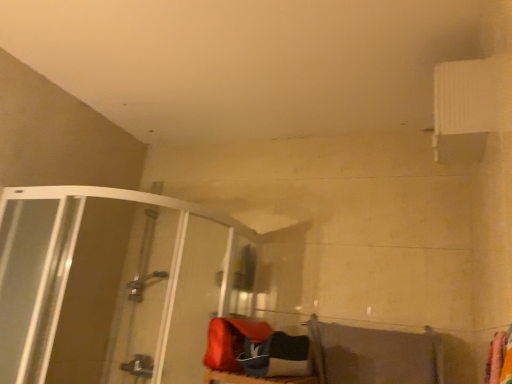
Question: Is transparent glass shower door at left in front of or behind gray fabric beach towel at lower right in the image?

Choices:
 (A) behind
 (B) front

Answer: (B)

Question: Is transparent glass shower door at left spatially inside gray fabric beach towel at lower right, or outside of it?

Choices:
 (A) inside
 (B) outside

Answer: (B)

Question: From a real-world perspective, is transparent glass shower door at left above or below gray fabric beach towel at lower right?

Choices:
 (A) below
 (B) above

Answer: (B)

Question: Considering the positions of gray fabric beach towel at lower right and transparent glass shower door at left in the image, is gray fabric beach towel at lower right wider or thinner than transparent glass shower door at left?

Choices:
 (A) thin
 (B) wide

Answer: (A)

Question: Do you think gray fabric beach towel at lower right is within transparent glass shower door at left, or outside of it?

Choices:
 (A) inside
 (B) outside

Answer: (B)

Question: From the image's perspective, is gray fabric beach towel at lower right positioned above or below transparent glass shower door at left?

Choices:
 (A) below
 (B) above

Answer: (A)

Question: From their relative heights in the image, would you say gray fabric beach towel at lower right is taller or shorter than transparent glass shower door at left?

Choices:
 (A) short
 (B) tall

Answer: (A)